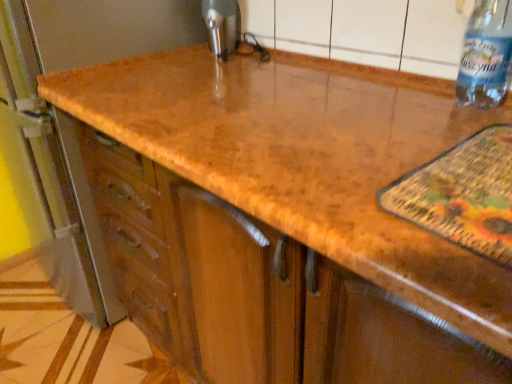
Question: Considering the relative sizes of transparent plastic bottle at upper right and metallic faucet at upper center in the image provided, is transparent plastic bottle at upper right shorter than metallic faucet at upper center?

Choices:
 (A) no
 (B) yes

Answer: (A)

Question: Can you confirm if transparent plastic bottle at upper right is bigger than metallic faucet at upper center?

Choices:
 (A) yes
 (B) no

Answer: (A)

Question: Is transparent plastic bottle at upper right placed right next to metallic faucet at upper center?

Choices:
 (A) yes
 (B) no

Answer: (B)

Question: Is transparent plastic bottle at upper right at the left side of metallic faucet at upper center?

Choices:
 (A) no
 (B) yes

Answer: (A)

Question: Can you confirm if transparent plastic bottle at upper right is wider than metallic faucet at upper center?

Choices:
 (A) no
 (B) yes

Answer: (B)

Question: Is transparent plastic bottle at upper right positioned far away from metallic faucet at upper center?

Choices:
 (A) yes
 (B) no

Answer: (B)

Question: Is metallic faucet at upper center smaller than transparent plastic bottle at upper right?

Choices:
 (A) no
 (B) yes

Answer: (B)

Question: Is metallic faucet at upper center positioned with its back to transparent plastic bottle at upper right?

Choices:
 (A) yes
 (B) no

Answer: (B)

Question: Does metallic faucet at upper center have a greater width compared to transparent plastic bottle at upper right?

Choices:
 (A) yes
 (B) no

Answer: (B)

Question: Is metallic faucet at upper center positioned beyond the bounds of transparent plastic bottle at upper right?

Choices:
 (A) yes
 (B) no

Answer: (A)

Question: Could you tell me if metallic faucet at upper center is facing transparent plastic bottle at upper right?

Choices:
 (A) yes
 (B) no

Answer: (B)

Question: Is metallic faucet at upper center at the left side of transparent plastic bottle at upper right?

Choices:
 (A) no
 (B) yes

Answer: (B)

Question: Considering the positions of metallic faucet at upper center and transparent plastic bottle at upper right in the image, is metallic faucet at upper center wider or thinner than transparent plastic bottle at upper right?

Choices:
 (A) wide
 (B) thin

Answer: (B)